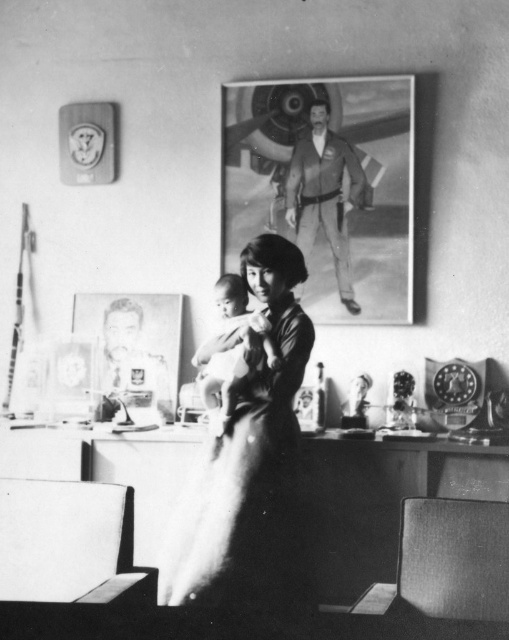
Question: Which of the following is the closest to the observer?

Choices:
 (A) smooth leather jacket at upper center
 (B) smooth skin baby at center
 (C) smooth fabric dress at center

Answer: (C)

Question: Which object appears closest to the camera in this image?

Choices:
 (A) smooth fabric dress at center
 (B) smooth paper portrait at upper center
 (C) smooth leather jacket at upper center
 (D) smooth skin baby at center

Answer: (A)

Question: Is smooth paper portrait at upper center to the right of smooth fabric dress at center from the viewer's perspective?

Choices:
 (A) no
 (B) yes

Answer: (B)

Question: Where is smooth fabric dress at center located in relation to smooth skin baby at center in the image?

Choices:
 (A) above
 (B) below

Answer: (B)

Question: Which point is closer to the camera?

Choices:
 (A) smooth fabric dress at center
 (B) smooth paper portrait at upper center
 (C) smooth leather jacket at upper center

Answer: (A)

Question: In this image, where is smooth fabric dress at center located relative to smooth leather jacket at upper center?

Choices:
 (A) above
 (B) below

Answer: (B)